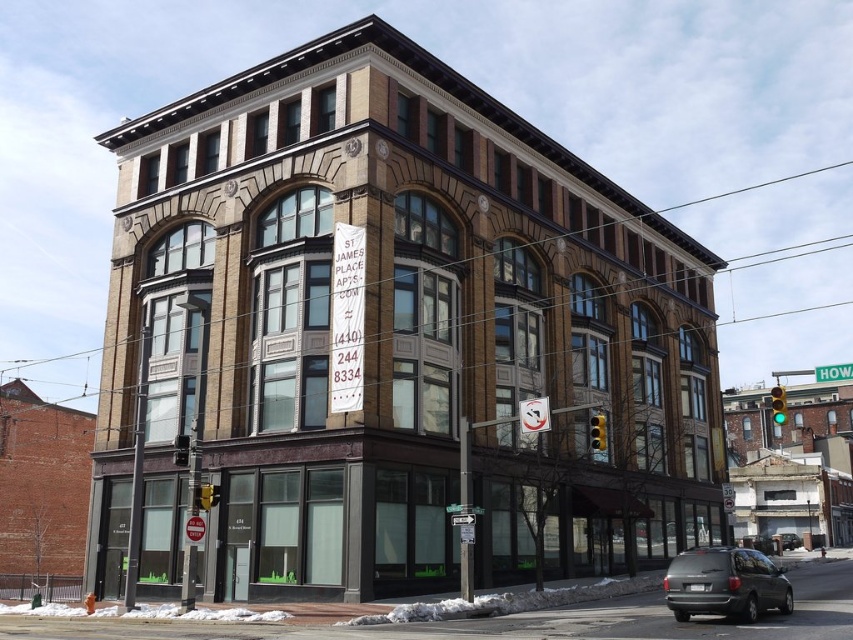
Question: Which point is closer to the camera taking this photo?

Choices:
 (A) (721, 584)
 (B) (791, 548)

Answer: (A)

Question: Does matte gray minivan at lower right appear on the right side of black matte van at center?

Choices:
 (A) no
 (B) yes

Answer: (A)

Question: Is matte gray minivan at lower right smaller than black matte van at center?

Choices:
 (A) yes
 (B) no

Answer: (B)

Question: Does matte gray minivan at lower right lie behind black matte van at center?

Choices:
 (A) no
 (B) yes

Answer: (A)

Question: Which point is closer to the camera?

Choices:
 (A) black matte van at center
 (B) matte gray minivan at lower right

Answer: (B)

Question: Which point is farther to the camera?

Choices:
 (A) matte gray minivan at lower right
 (B) black matte van at center

Answer: (B)